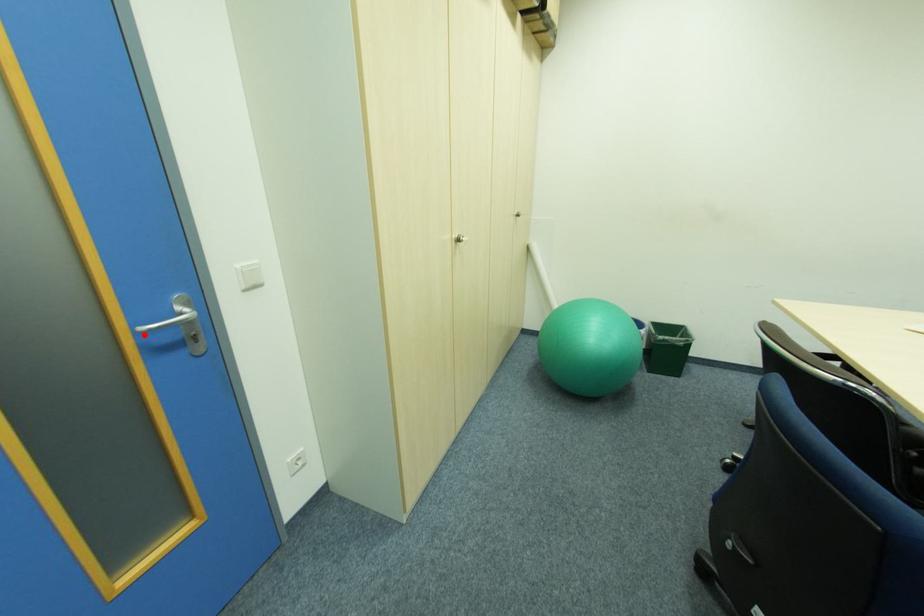
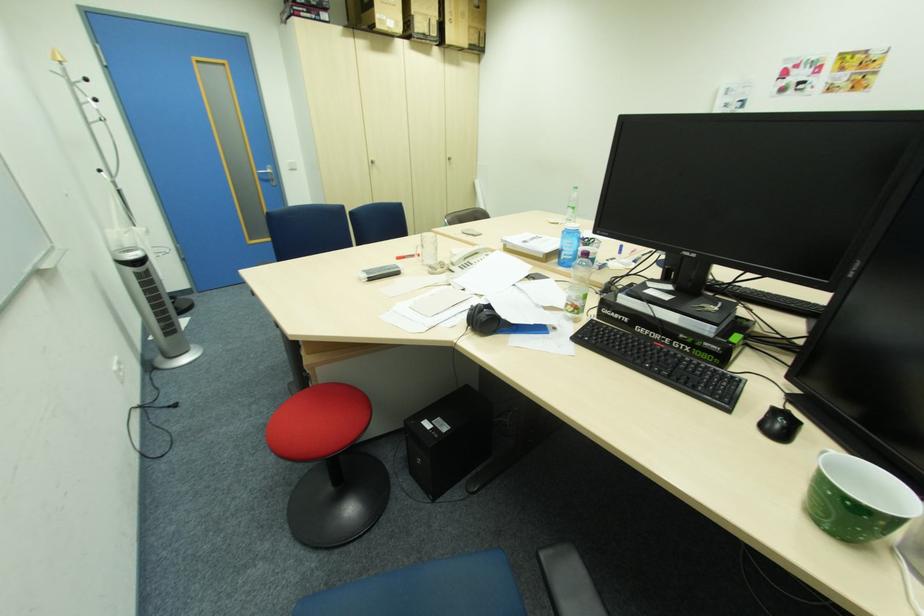
Locate, in the second image, the point that corresponds to the highlighted location in the first image.

(264, 174)